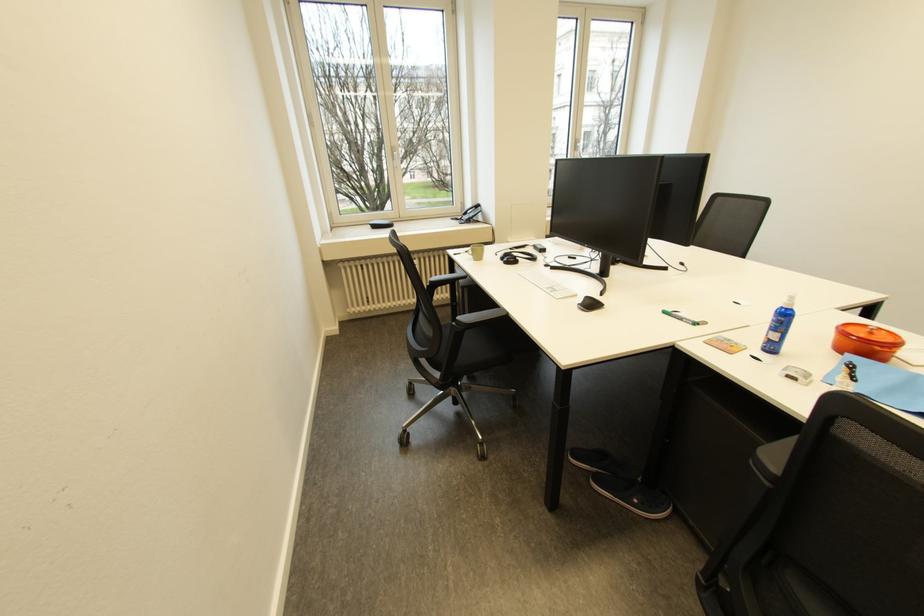
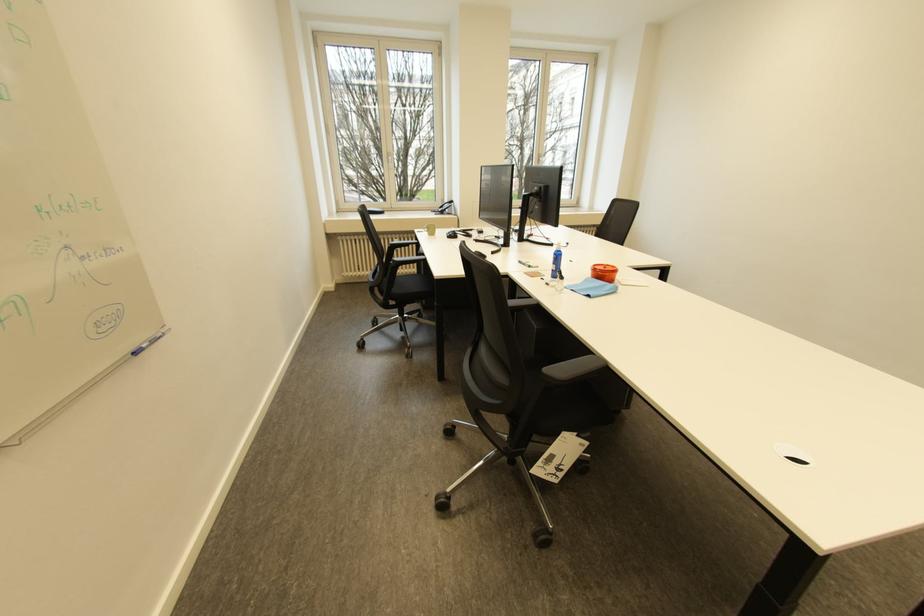
Where in the second image is the point corresponding to the point at 881,334 from the first image?

(614, 268)